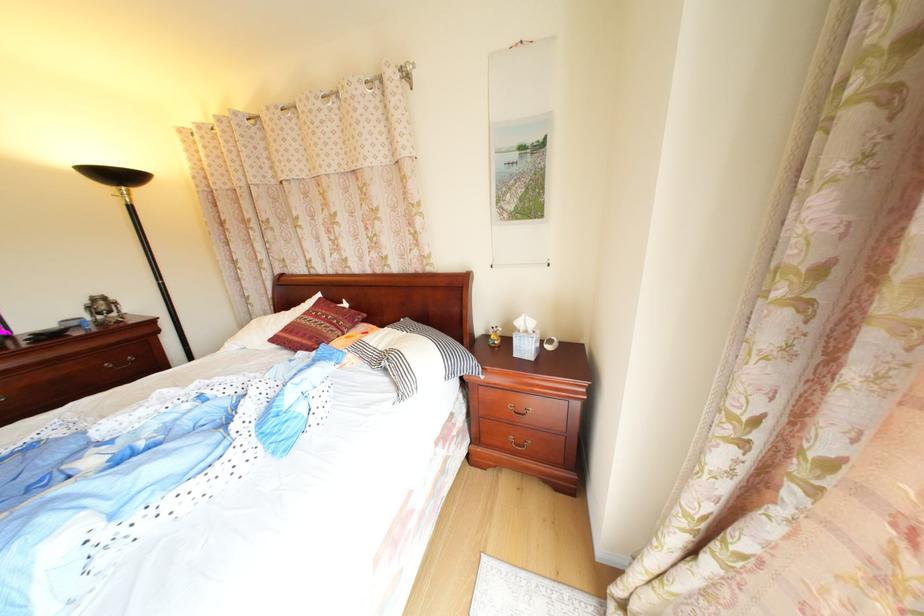
At what (x,y) coordinates should I click in order to perform the action: click on red patterned pillow. Please return your answer as a coordinate pair (x, y). The image size is (924, 616). Looking at the image, I should click on (317, 326).